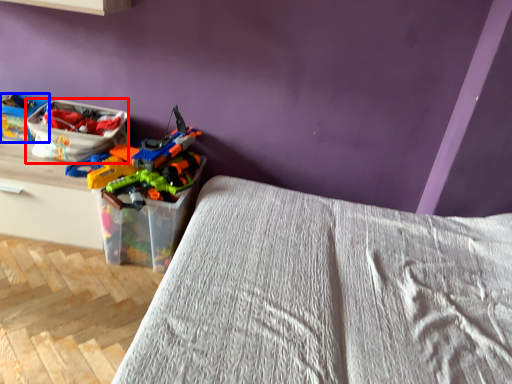
Question: Which point is further to the camera, kit (highlighted by a red box) or kit (highlighted by a blue box)?

Choices:
 (A) kit
 (B) kit

Answer: (B)